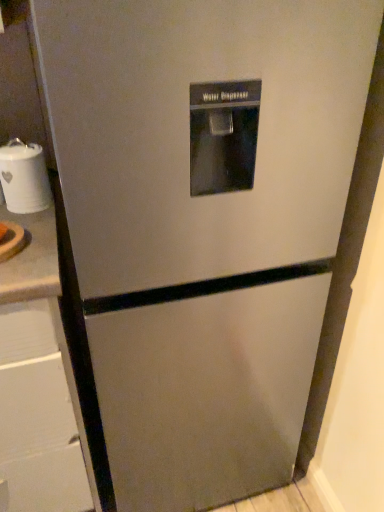
Question: Relative to white ceramic jar at left, is brushed metal drawer at left in front or behind?

Choices:
 (A) front
 (B) behind

Answer: (A)

Question: Looking at the image, does brushed metal drawer at left seem bigger or smaller compared to white ceramic jar at left?

Choices:
 (A) big
 (B) small

Answer: (A)

Question: Based on their positions, is brushed metal drawer at left located to the left or right of white ceramic jar at left?

Choices:
 (A) right
 (B) left

Answer: (B)

Question: From a real-world perspective, is white ceramic jar at left above or below brushed metal drawer at left?

Choices:
 (A) above
 (B) below

Answer: (A)

Question: Is point (34, 168) positioned closer to the camera than point (56, 349)?

Choices:
 (A) closer
 (B) farther

Answer: (B)

Question: In the image, is white ceramic jar at left on the left side or the right side of brushed metal drawer at left?

Choices:
 (A) left
 (B) right

Answer: (B)

Question: Considering the positions of white ceramic jar at left and brushed metal drawer at left in the image, is white ceramic jar at left bigger or smaller than brushed metal drawer at left?

Choices:
 (A) small
 (B) big

Answer: (A)